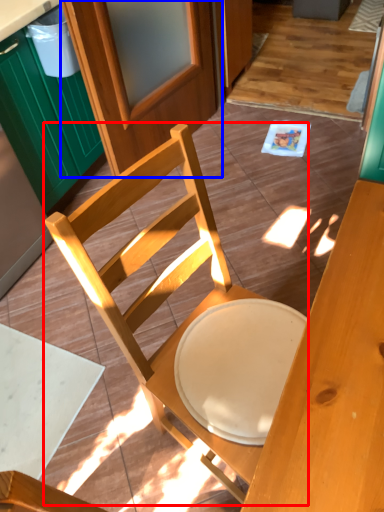
Question: Which object is closer to the camera taking this photo, chair (highlighted by a red box) or screen door (highlighted by a blue box)?

Choices:
 (A) chair
 (B) screen door

Answer: (A)